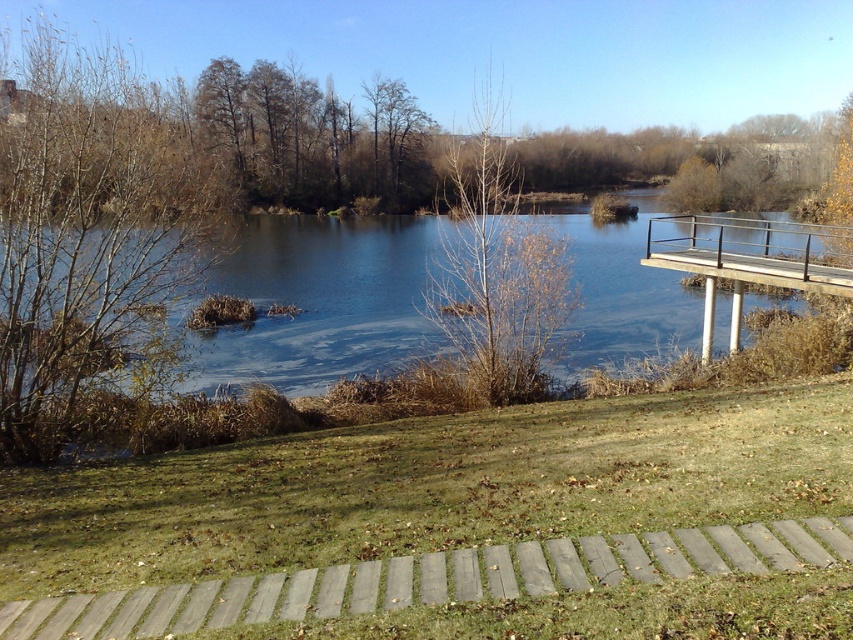
You are standing on the wooden pathway and looking towards the blue water at center and the bare branches at center. Which object is closer to you?

The blue water at center is positioned under the bare branches at center, so the bare branches at center are closer to you.

You are standing on the wooden pathway and want to walk to the blue water at center. Which direction should you walk relative to the brown leafy tree at left?

You should walk to the right of the brown leafy tree at left to reach the blue water at center since the blue water at center is to the right of the brown leafy tree at left.